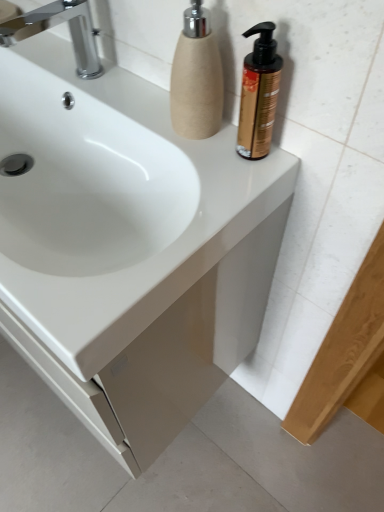
Where is `free space in front of beige textured soap dispenser at upper right, which is the first soap dispenser in left-to-right order`? Image resolution: width=384 pixels, height=512 pixels. free space in front of beige textured soap dispenser at upper right, which is the first soap dispenser in left-to-right order is located at coordinates (208, 180).